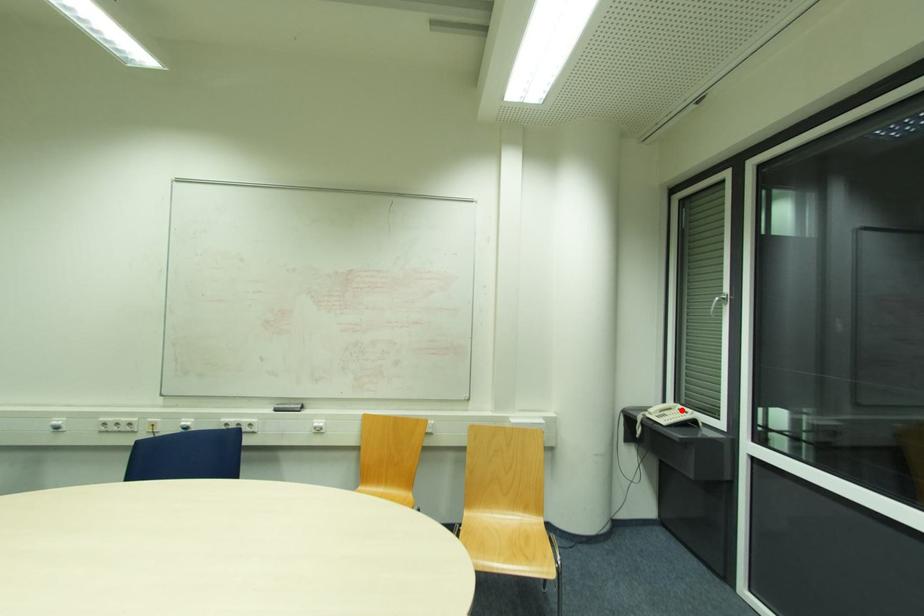
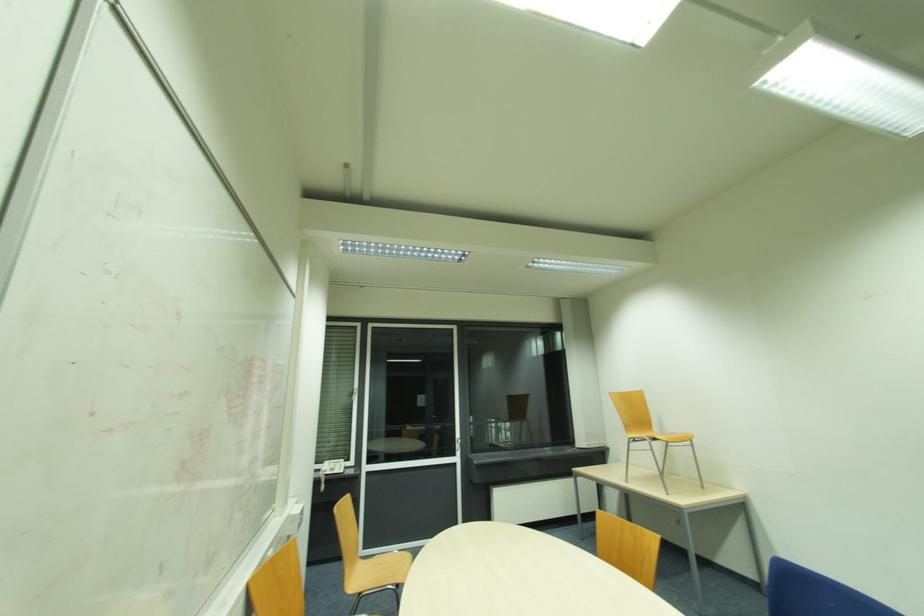
Question: A red point is marked in image1. In image2, is the corresponding 3D point closer to the camera or farther? Reply with the corresponding letter.

Choices:
 (A) The corresponding 3D point is closer.
 (B) The corresponding 3D point is farther.

Answer: (B)